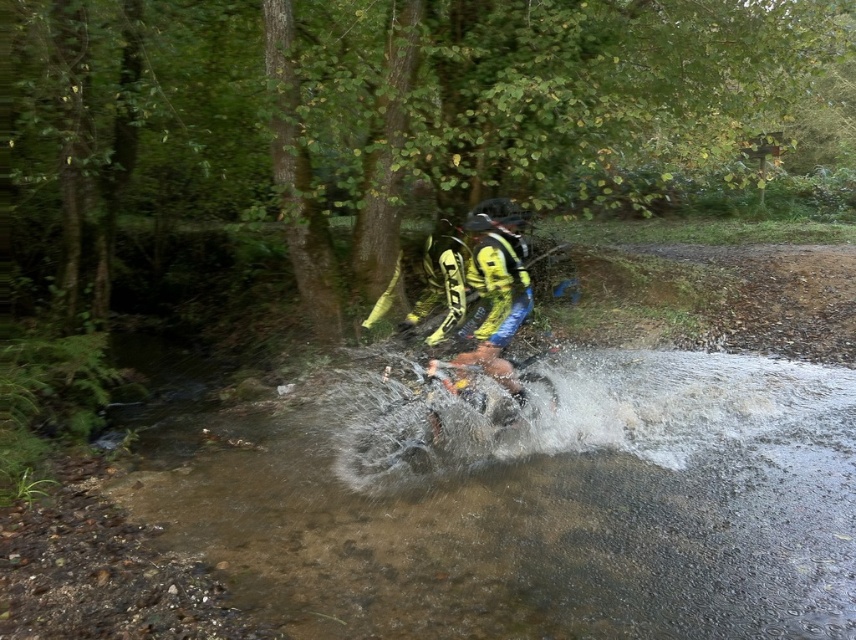
Question: From the image, what is the correct spatial relationship of clear water at center in relation to yellow/textured motorcycle at center?

Choices:
 (A) below
 (B) above

Answer: (A)

Question: Is clear water at center positioned behind yellow/textured motorcycle at center?

Choices:
 (A) no
 (B) yes

Answer: (A)

Question: Which object appears farthest from the camera in this image?

Choices:
 (A) clear water at center
 (B) yellow/textured motorcycle at center

Answer: (B)

Question: Which point is farther from the camera taking this photo?

Choices:
 (A) (688, 506)
 (B) (516, 301)

Answer: (B)

Question: Does clear water at center appear on the right side of yellow/textured motorcycle at center?

Choices:
 (A) no
 (B) yes

Answer: (A)